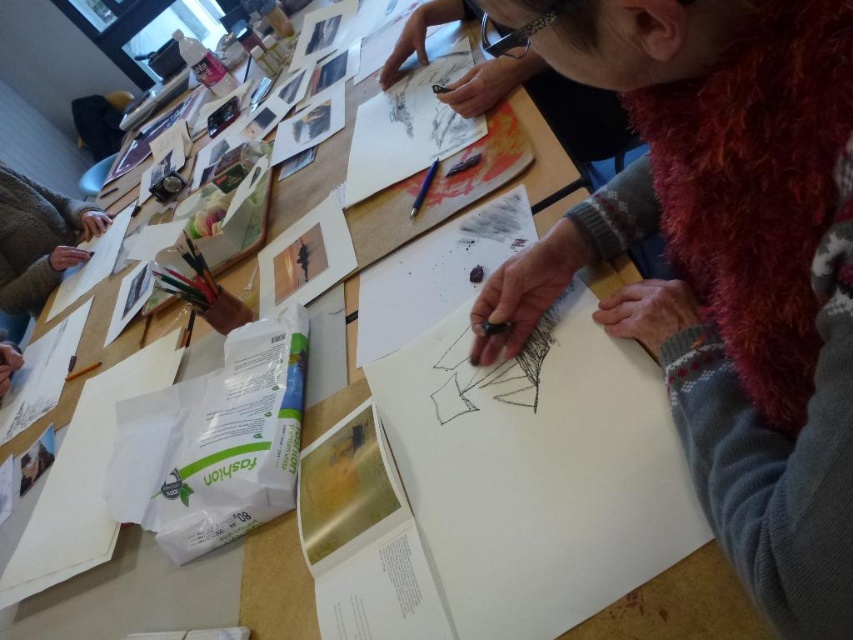
Which of these two, white paper at center or blue metallic pencil at center, stands taller?

Standing taller between the two is white paper at center.

Can you confirm if white paper at center is positioned above blue metallic pencil at center?

Yes, white paper at center is above blue metallic pencil at center.

Is point (432, 65) more distant than point (424, 188)?

Yes.

Identify the location of white paper at center. (408, 128).